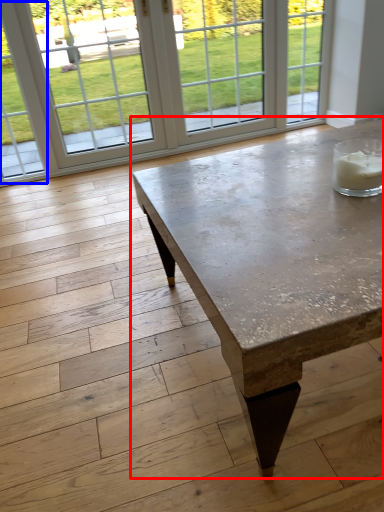
Question: Which of the following is the farthest to the observer, coffee table (highlighted by a red box) or window (highlighted by a blue box)?

Choices:
 (A) coffee table
 (B) window

Answer: (B)